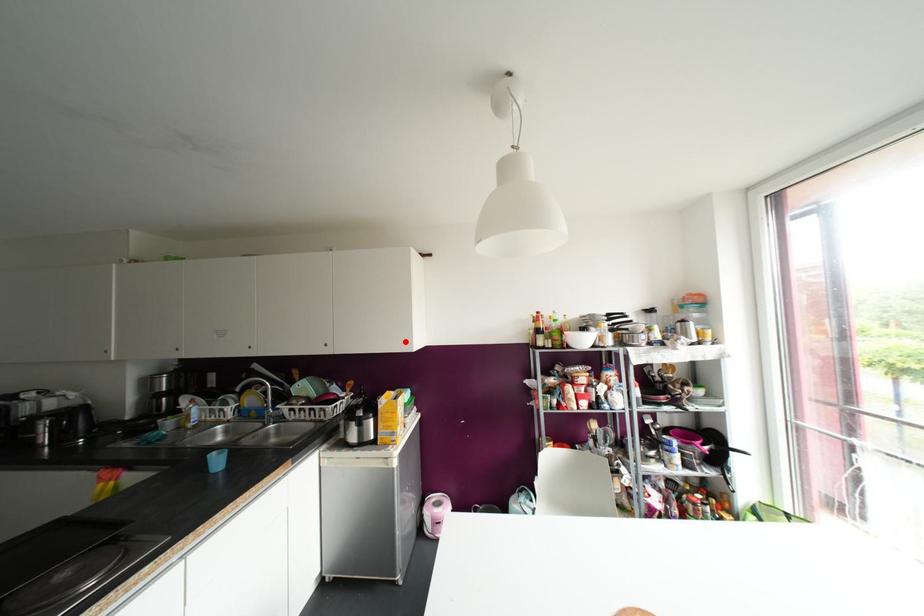
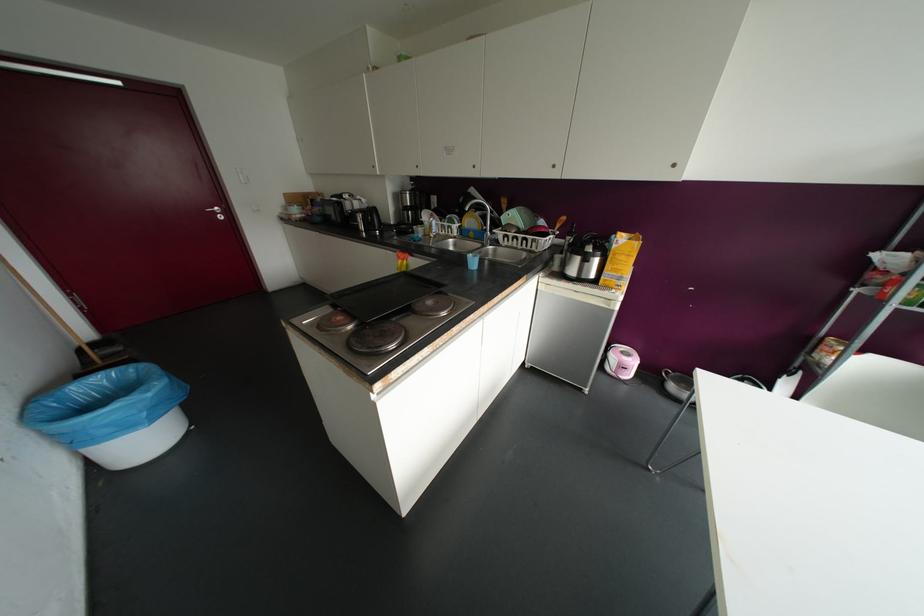
Find the pixel in the second image that matches the highlighted location in the first image.

(673, 164)